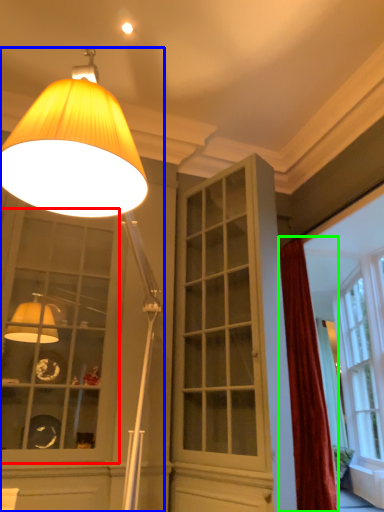
Question: Considering the real-world distances, which object is closest to window (highlighted by a red box)? lamp (highlighted by a blue box) or curtain (highlighted by a green box).

Choices:
 (A) lamp
 (B) curtain

Answer: (B)